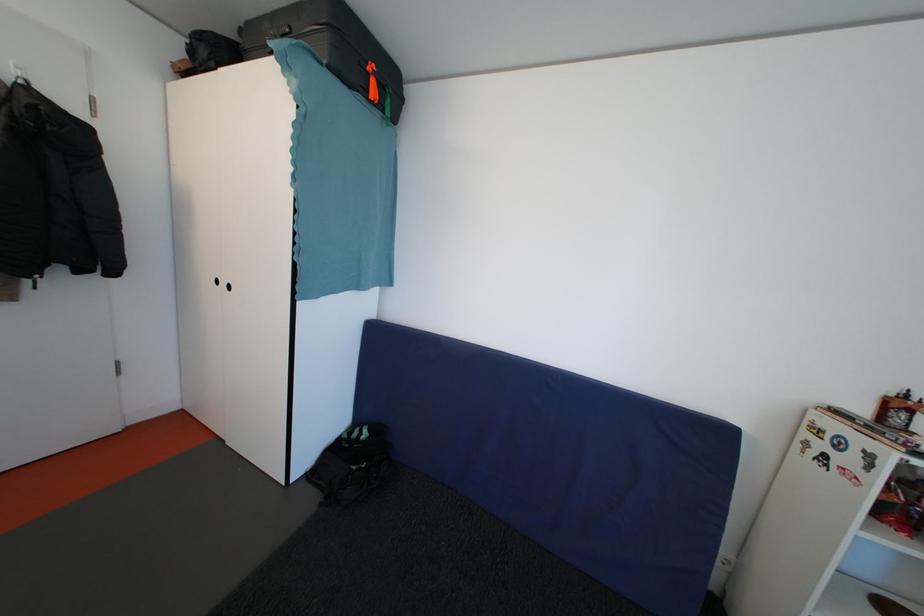
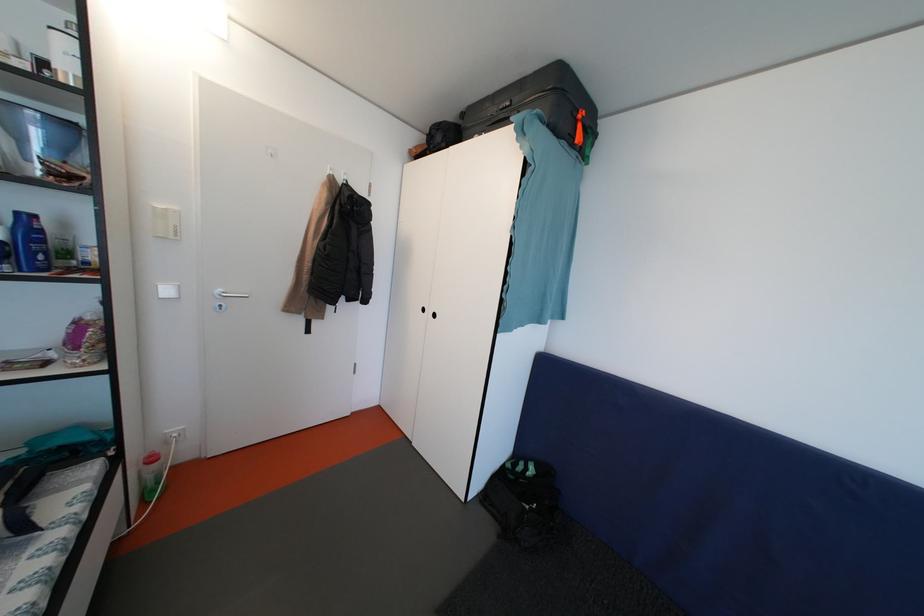
Locate, in the second image, the point that corresponds to point (298, 34) in the first image.

(518, 107)